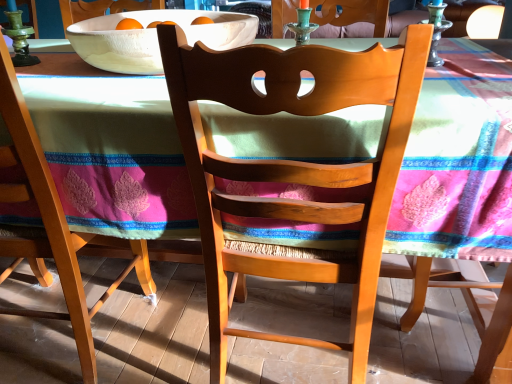
The image size is (512, 384). Identify the location of free location in front of green glass candle holder at upper right, the second candle holder in the left-to-right sequence. (455, 77).